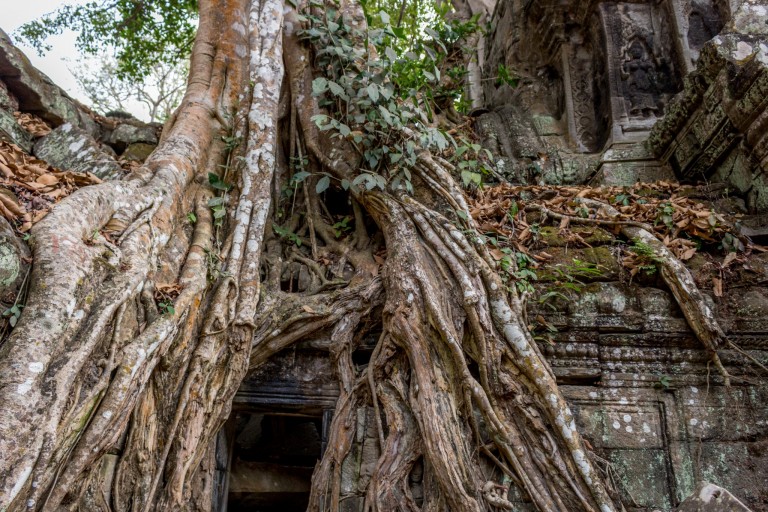
The width and height of the screenshot is (768, 512). In order to click on doorway in this screenshot , I will do `click(257, 395)`.